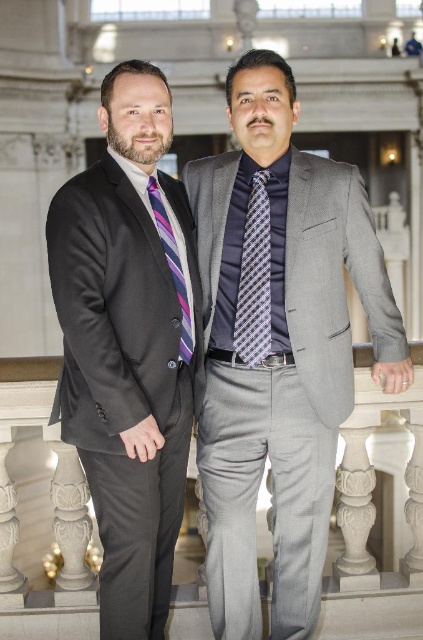
Can you confirm if matte black suit at left is shorter than striped silk tie at center?

No, matte black suit at left is not shorter than striped silk tie at center.

Identify the location of matte black suit at left. (129, 344).

Can you confirm if white marble balustrade at lower center is wider than navy satin tie at center?

Indeed, white marble balustrade at lower center has a greater width compared to navy satin tie at center.

Does white marble balustrade at lower center appear on the right side of navy satin tie at center?

In fact, white marble balustrade at lower center is to the left of navy satin tie at center.

Who is more forward, (87, 577) or (242, 300)?

Point (87, 577) is more forward.

Identify the location of white marble balustrade at lower center. This screenshot has height=640, width=423. (375, 518).

Can you confirm if matte black suit at left is positioned below white marble balustrade at lower center?

No.

Between matte black suit at left and white marble balustrade at lower center, which one has more height?

Standing taller between the two is matte black suit at left.

Who is more forward, (142, 424) or (420, 620)?

Point (142, 424) is in front.

I want to click on matte black suit at left, so click(x=129, y=344).